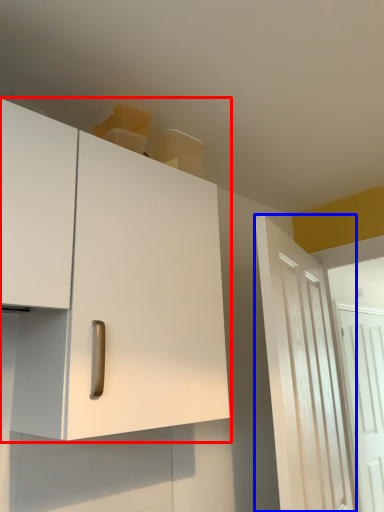
Question: Which of the following is the closest to the observer, cabinetry (highlighted by a red box) or door (highlighted by a blue box)?

Choices:
 (A) cabinetry
 (B) door

Answer: (A)